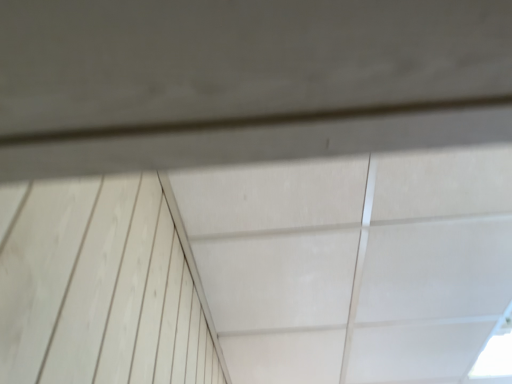
In order to click on transparent glass window at lower right in this screenshot , I will do `click(495, 354)`.

What do you see at coordinates (495, 354) in the screenshot? The width and height of the screenshot is (512, 384). I see `transparent glass window at lower right` at bounding box center [495, 354].

Locate an element on the screen. transparent glass window at lower right is located at coordinates (495, 354).